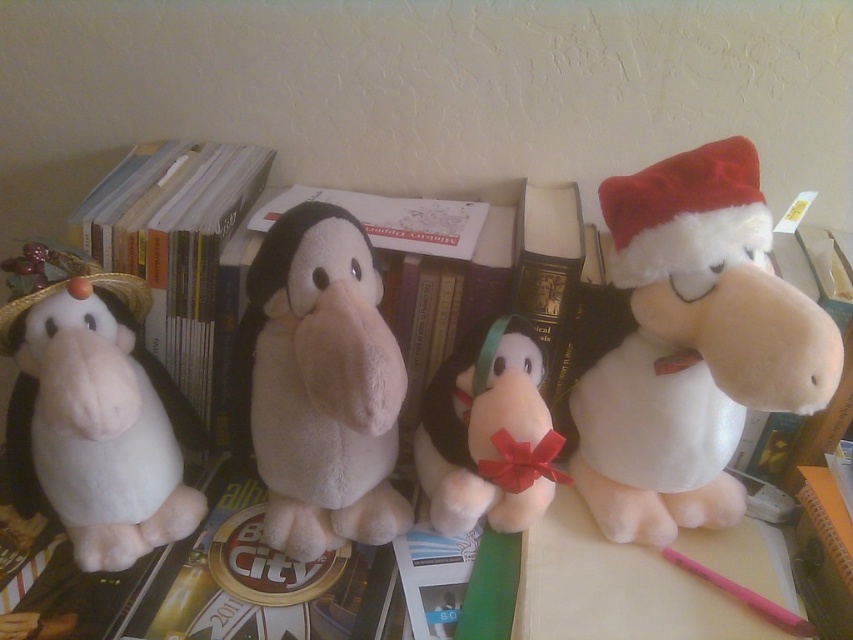
You are organizing a display of plush toys on a shelf. You have the white plush hippo at left and the white plush toy at center. According to the scene, which one is placed higher up?

The white plush hippo at left is positioned over the white plush toy at center, so it is placed higher up.

You are organizing a display of plush toys on a shelf. You have the white plush hippo at left and the white plush toy at center. According to the image, which one should be placed to the right side of the other?

The white plush hippo at left is to the left of the white plush toy at center, so the white plush toy at center should be placed to the right side of the white plush hippo at left.

You are organizing a display of plush toys on a shelf. You have the white plush hippo at left and the white plush toy at center. Which one should you place closer to the front of the shelf to match the original arrangement?

You should place the white plush hippo at left closer to the front of the shelf because it was originally in front of the white plush toy at center.